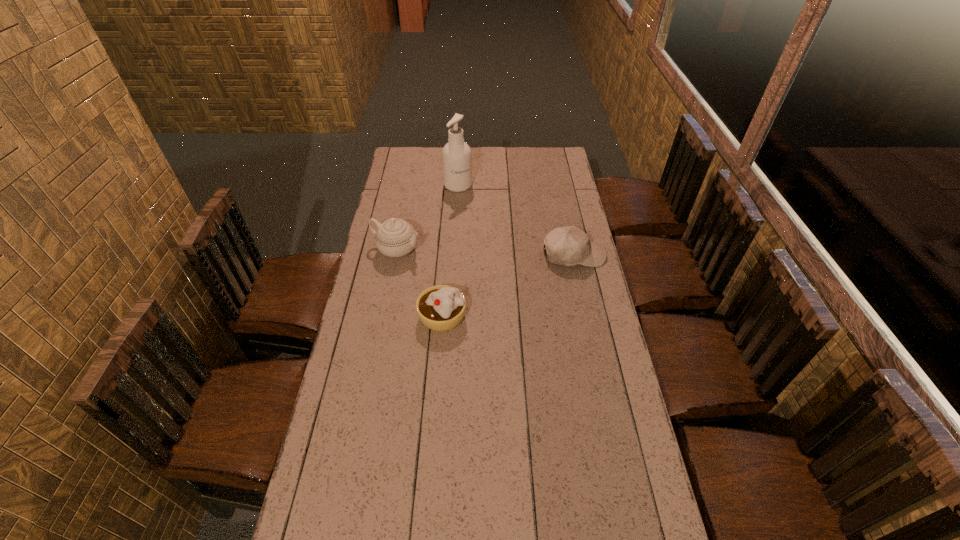
The width and height of the screenshot is (960, 540). Identify the location of free space between the second tallest object and the tallest object. (427, 218).

Locate an element on the screen. The width and height of the screenshot is (960, 540). free space between the whipped cream and the tallest object is located at coordinates (450, 251).

The width and height of the screenshot is (960, 540). Find the location of `free spot between the leftmost object and the nearest object`. free spot between the leftmost object and the nearest object is located at coordinates (420, 283).

The image size is (960, 540). Find the location of `vacant region between the baseball cap and the farthest object`. vacant region between the baseball cap and the farthest object is located at coordinates (516, 220).

The height and width of the screenshot is (540, 960). Identify the location of vacant space that is in between the baseball cap and the leftmost object. (485, 253).

Locate an element on the screen. This screenshot has height=540, width=960. vacant point located between the farthest object and the nearest object is located at coordinates (450, 251).

The width and height of the screenshot is (960, 540). What are the coordinates of `vacant point located between the rightmost object and the farthest object` in the screenshot? It's located at (516, 220).

Identify the location of vacant space that is in between the farthest object and the rightmost object. This screenshot has height=540, width=960. (516, 220).

The height and width of the screenshot is (540, 960). I want to click on free space between the third shortest object and the rightmost object, so click(485, 253).

Where is `free space between the baseball cap and the cleansing agent`? free space between the baseball cap and the cleansing agent is located at coordinates (516, 220).